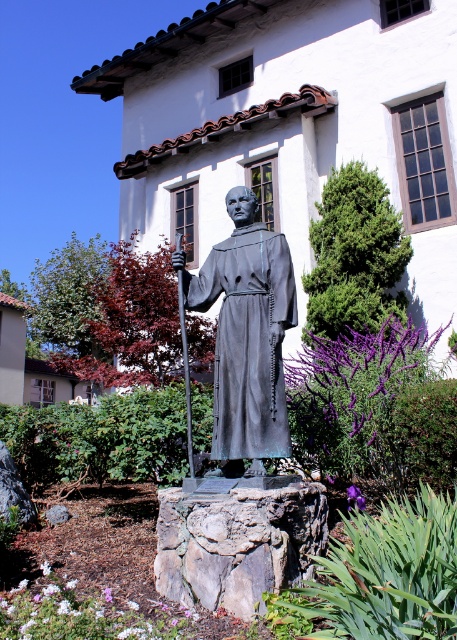
You are a landscape architect designing a garden path that needs to pass between the green mossy rock at center and the rough textured stone at center. The path must be at least 0.5 meters wide. Can you determine if there is enough space between them based on their height difference?

The green mossy rock at center is taller than the rough textured stone at center, but the height difference does not provide information about the horizontal space between them. Therefore, it is impossible to determine if the path can be 0.5 meters wide based solely on their heights.

You are a visitor at this serene location and want to take a photo of the statue. The statue has two notable features at its center. One is the green mossy rock, and the other is the polished bronze robe. Since you want to capture both features in the same frame, can you position yourself in a way that allows you to see both the green mossy rock at center and the polished bronze robe at center simultaneously?

The green mossy rock at center is to the right of the polished bronze robe at center, so you can position yourself in front of the statue between them to capture both features in the same frame.

You are an art conservator examining the statue of the friar. You notice the green mossy rock at center and the polished bronze robe at center. Which object is closer to you?

The green mossy rock at center is closer to you since it is positioned further to the viewer than the polished bronze robe at center.